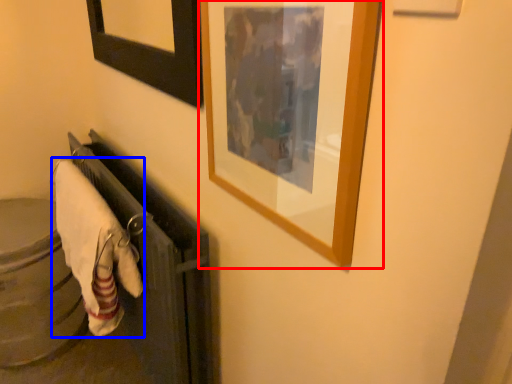
Question: Which object is further to the camera taking this photo, picture frame (highlighted by a red box) or bath towel (highlighted by a blue box)?

Choices:
 (A) picture frame
 (B) bath towel

Answer: (B)